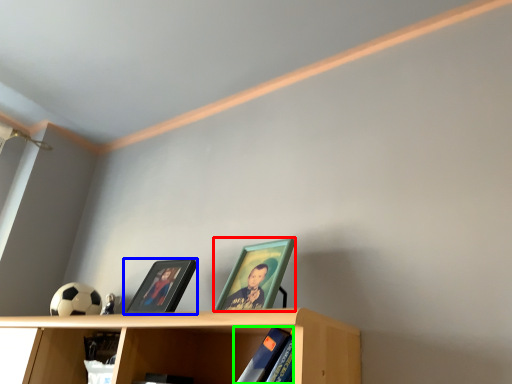
Question: Which object is positioned farthest from picture frame (highlighted by a red box)? Select from picture frame (highlighted by a blue box) and book (highlighted by a green box).

Choices:
 (A) picture frame
 (B) book

Answer: (A)